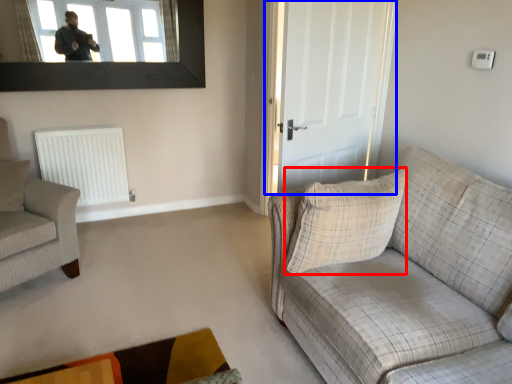
Question: Which of the following is the farthest to the observer, pillow (highlighted by a red box) or door (highlighted by a blue box)?

Choices:
 (A) pillow
 (B) door

Answer: (B)